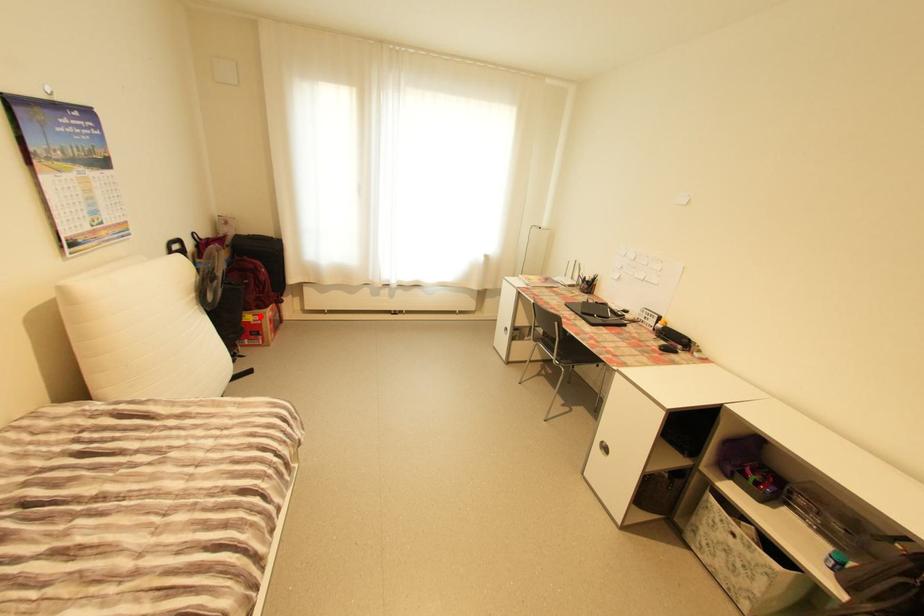
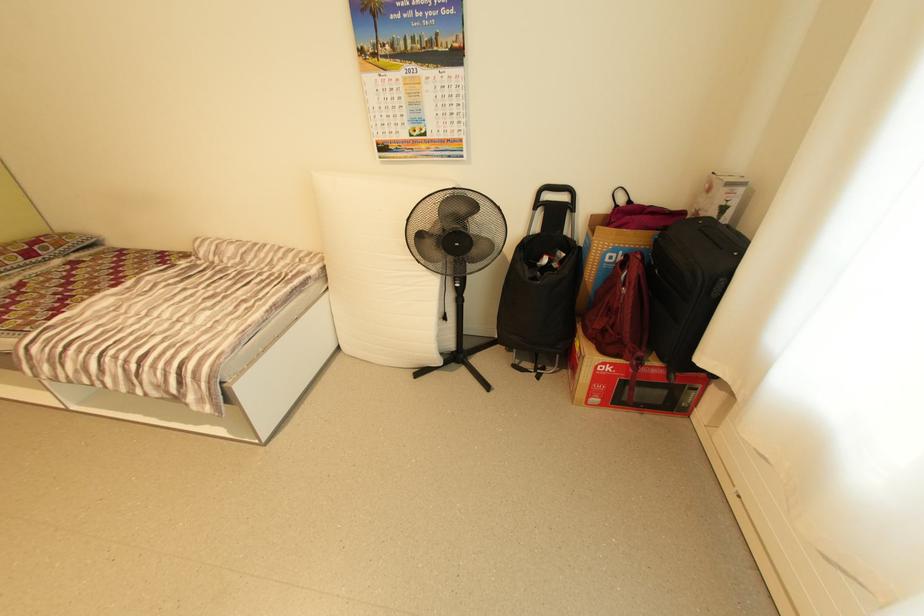
Question: I am providing you with two images of the same scene from different viewpoints. In image1, a red point is highlighted. Considering the same 3D point in image2, which of the following is correct?

Choices:
 (A) It is closer
 (B) It is farther

Answer: (B)